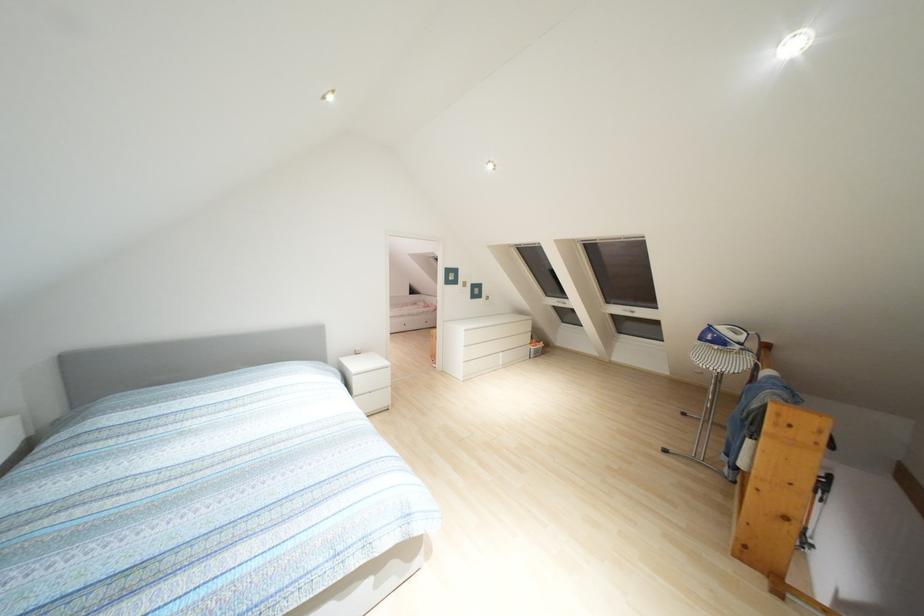
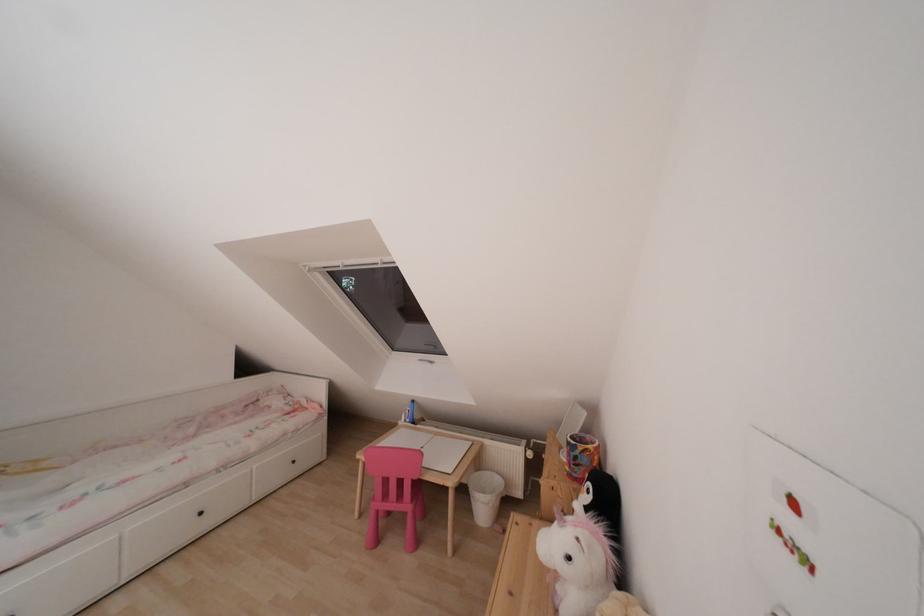
Question: The images are taken continuously from a first-person perspective. In which direction are you moving?

Choices:
 (A) Left
 (B) Right
 (C) Forward
 (D) Backward

Answer: (C)